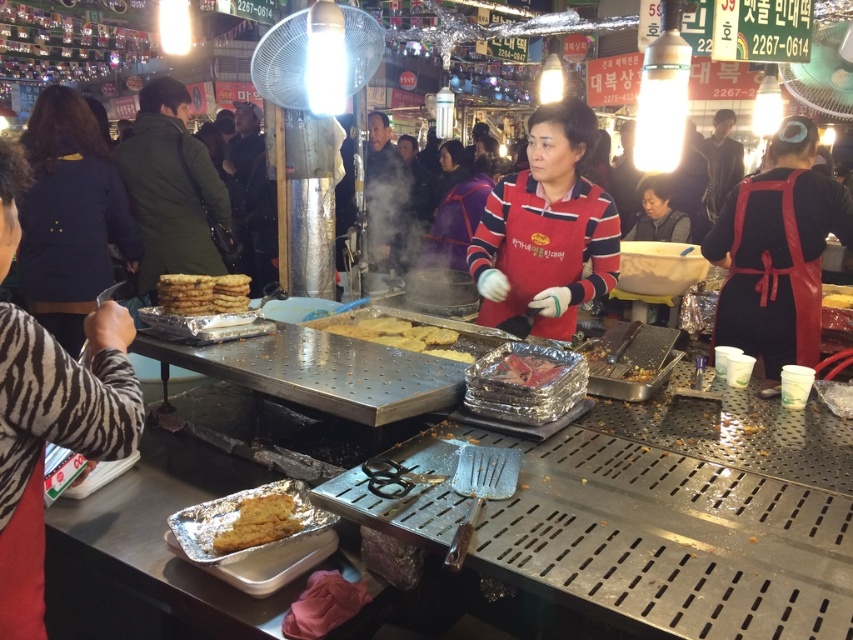
Question: From the image, what is the correct spatial relationship of golden crispy pancake at center in relation to golden crispy pastry at center?

Choices:
 (A) below
 (B) above

Answer: (A)

Question: Which of these objects is positioned closest to the dark blue fabric jacket at left?

Choices:
 (A) yellow matte cake at lower left
 (B) shiny metallic foil at center
 (C) golden crispy pastry at center
 (D) golden crispy pancake at center

Answer: (C)

Question: Does dark blue fabric jacket at left appear over golden crispy pancake at center?

Choices:
 (A) yes
 (B) no

Answer: (A)

Question: Is golden crispy pastry at center to the right of shiny metallic foil at center from the viewer's perspective?

Choices:
 (A) no
 (B) yes

Answer: (A)

Question: Which object is positioned farthest from the yellow matte cake at lower left?

Choices:
 (A) golden crispy pastry at center
 (B) dark blue fabric jacket at left
 (C) golden crispy pancake at center

Answer: (B)

Question: Which object is the farthest from the shiny metallic foil at center?

Choices:
 (A) golden crispy pancake at center
 (B) golden crispy pastry at center
 (C) dark blue fabric jacket at left

Answer: (C)